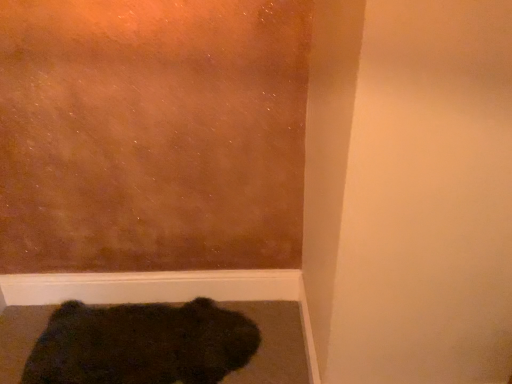
What is the approximate height of dark fur rug at lower left?

2.91 inches.

Image resolution: width=512 pixels, height=384 pixels. I want to click on dark fur rug at lower left, so click(141, 344).

The height and width of the screenshot is (384, 512). What do you see at coordinates (141, 344) in the screenshot?
I see `dark fur rug at lower left` at bounding box center [141, 344].

This screenshot has width=512, height=384. I want to click on dark fur rug at lower left, so click(x=141, y=344).